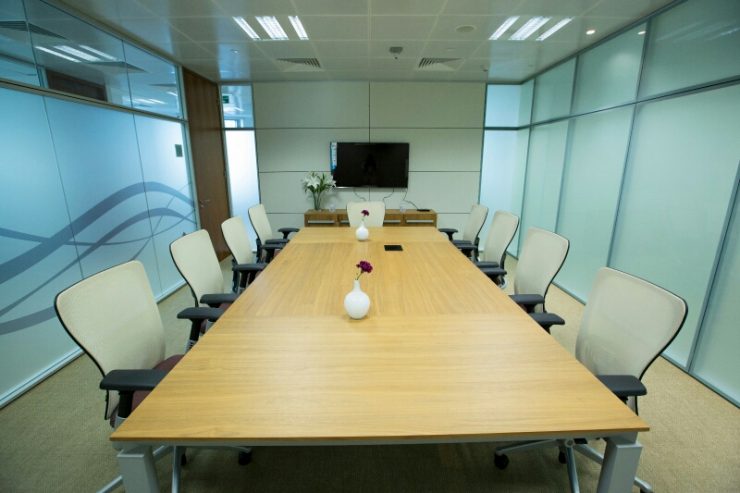
The height and width of the screenshot is (493, 740). Find the location of `overhead sprinkler`. overhead sprinkler is located at coordinates (396, 54).